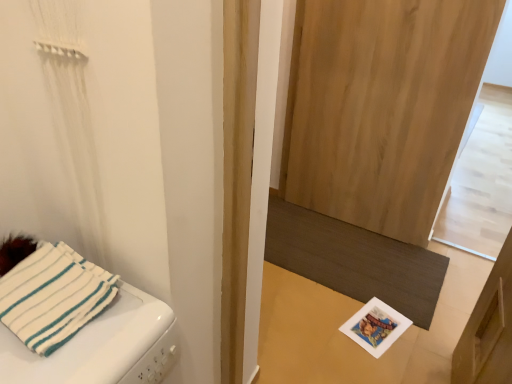
From the picture: Measure the distance between dark brown textured mat at lower center and camera.

A distance of 6.45 feet exists between dark brown textured mat at lower center and camera.

The width and height of the screenshot is (512, 384). I want to click on white fabric towel at left, so click(79, 324).

Find the location of a particular element. The image size is (512, 384). dark brown textured mat at lower center is located at coordinates (354, 260).

Would you say white fabric towel at left is a long distance from natural wood screen door at center?

Yes.

Is white fabric towel at left surrounding natural wood screen door at center?

No, natural wood screen door at center is not inside white fabric towel at left.

Is white fabric towel at left wider or thinner than natural wood screen door at center?

In the image, white fabric towel at left appears to be wider than natural wood screen door at center.

From a real-world perspective, does white fabric towel at left sit lower than natural wood screen door at center?

Correct, in the physical world, white fabric towel at left is lower than natural wood screen door at center.

Find the location of a particular element. Image resolution: width=512 pixels, height=384 pixels. mat on the left of natural wood screen door at center is located at coordinates (354, 260).

Looking at the image, does dark brown textured mat at lower center seem bigger or smaller compared to natural wood screen door at center?

In the image, dark brown textured mat at lower center appears to be smaller than natural wood screen door at center.

From a real-world perspective, who is located higher, dark brown textured mat at lower center or natural wood screen door at center?

natural wood screen door at center is physically above.

Is natural wood screen door at center oriented away from white fabric towel at left?

natural wood screen door at center does not have its back to white fabric towel at left.

Can you tell me how much natural wood screen door at center and white fabric towel at left differ in facing direction?

The angle between the facing direction of natural wood screen door at center and the facing direction of white fabric towel at left is 89 degrees.

Is natural wood screen door at center inside or outside of white fabric towel at left?

natural wood screen door at center is not enclosed by white fabric towel at left.

Which is closer to the camera, (331, 24) or (5, 335)?

The point (5, 335) is closer.

The width and height of the screenshot is (512, 384). What are the coordinates of `mat behind the white fabric towel at left` in the screenshot? It's located at (354, 260).

Based on their positions, is white fabric towel at left located to the left or right of dark brown textured mat at lower center?

From the image, it's evident that white fabric towel at left is to the left of dark brown textured mat at lower center.

Can you confirm if white fabric towel at left is wider than dark brown textured mat at lower center?

In fact, white fabric towel at left might be narrower than dark brown textured mat at lower center.

Does point (95, 318) come farther from viewer compared to point (428, 251)?

No, (95, 318) is closer to viewer.

Can you confirm if natural wood screen door at center is bigger than dark brown textured mat at lower center?

Correct, natural wood screen door at center is larger in size than dark brown textured mat at lower center.

From a real-world perspective, is natural wood screen door at center on top of dark brown textured mat at lower center?

Yes.

Considering the positions of point (372, 23) and point (360, 239), is point (372, 23) closer or farther from the camera than point (360, 239)?

Point (372, 23) is closer to the camera than point (360, 239).

Considering the sizes of objects dark brown textured mat at lower center and white fabric towel at left in the image provided, who is bigger, dark brown textured mat at lower center or white fabric towel at left?

white fabric towel at left.

Considering the relative positions of dark brown textured mat at lower center and white fabric towel at left in the image provided, is dark brown textured mat at lower center to the left or to the right of white fabric towel at left?

Clearly, dark brown textured mat at lower center is on the right of white fabric towel at left in the image.

Is dark brown textured mat at lower center thinner than white fabric towel at left?

No, dark brown textured mat at lower center is not thinner than white fabric towel at left.

Is dark brown textured mat at lower center taller or shorter than white fabric towel at left?

dark brown textured mat at lower center is shorter than white fabric towel at left.

Find the location of a particular element. This screenshot has width=512, height=384. furniture that is under the natural wood screen door at center (from a real-world perspective) is located at coordinates (79, 324).

This screenshot has height=384, width=512. What are the coordinates of `mat on the left of natural wood screen door at center` in the screenshot? It's located at (354, 260).

Which object lies further to the anchor point natural wood screen door at center, dark brown textured mat at lower center or white fabric towel at left?

white fabric towel at left is further to natural wood screen door at center.

Looking at the image, which one is located further to white fabric towel at left, dark brown textured mat at lower center or natural wood screen door at center?

Among the two, natural wood screen door at center is located further to white fabric towel at left.

Based on the photo, based on their spatial positions, is white fabric towel at left or natural wood screen door at center closer to dark brown textured mat at lower center?

Based on the image, natural wood screen door at center appears to be nearer to dark brown textured mat at lower center.

Looking at the image, which one is located closer to white fabric towel at left, natural wood screen door at center or dark brown textured mat at lower center?

Among the two, dark brown textured mat at lower center is located nearer to white fabric towel at left.

When comparing their distances from dark brown textured mat at lower center, does natural wood screen door at center or white fabric towel at left seem further?

Among the two, white fabric towel at left is located further to dark brown textured mat at lower center.

From the image, which object appears to be nearer to natural wood screen door at center, white fabric towel at left or dark brown textured mat at lower center?

dark brown textured mat at lower center is positioned closer to the anchor natural wood screen door at center.

This screenshot has width=512, height=384. What are the coordinates of `screen door positioned between white fabric towel at left and dark brown textured mat at lower center from near to far` in the screenshot? It's located at (383, 106).